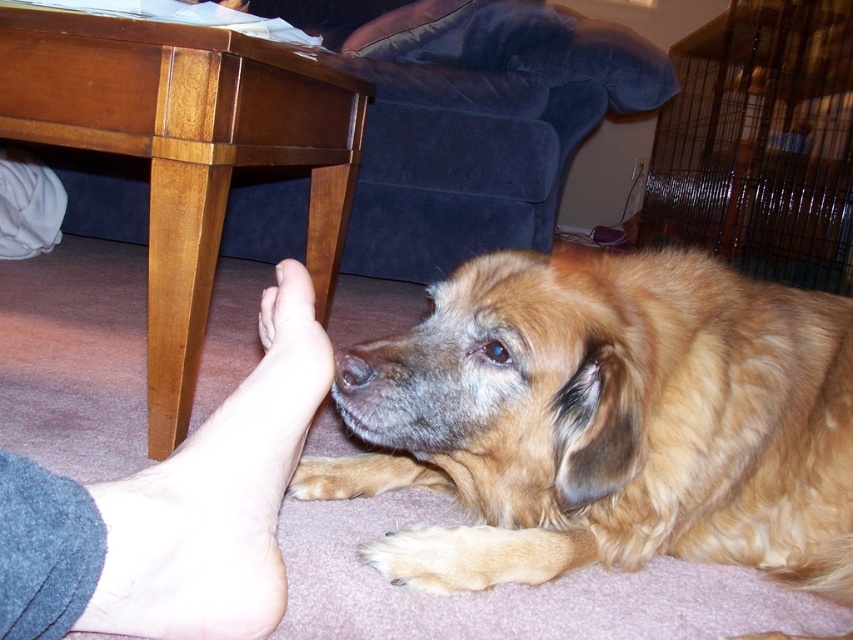
Between golden fur dog at lower right and black wire cage at upper right, which one is positioned lower?

golden fur dog at lower right

You are a GUI agent. You are given a task and a screenshot of the screen. Output one action in this format:
    pyautogui.click(x=<x>, y=<y>)
    Task: Click on the golden fur dog at lower right
    The height and width of the screenshot is (640, 853).
    Given the screenshot: What is the action you would take?
    pyautogui.click(x=607, y=420)

Where is `golden fur dog at lower right`? golden fur dog at lower right is located at coordinates (607, 420).

Between point (178, 38) and point (753, 13), which one is positioned behind?

Positioned behind is point (753, 13).

Between wooden table at lower left and black wire cage at upper right, which one has less height?

With less height is wooden table at lower left.

Measure the distance between point (206, 134) and camera.

They are 36.22 inches apart.

Identify the location of wooden table at lower left. (186, 152).

Is skinny flesh-toned foot at lower left above black wire cage at upper right?

No, skinny flesh-toned foot at lower left is not above black wire cage at upper right.

Is skinny flesh-toned foot at lower left to the right of black wire cage at upper right from the viewer's perspective?

Incorrect, skinny flesh-toned foot at lower left is not on the right side of black wire cage at upper right.

Is point (155, 502) in front of point (752, 234)?

Yes, point (155, 502) is closer to viewer.

Identify the location of skinny flesh-toned foot at lower left. (175, 508).